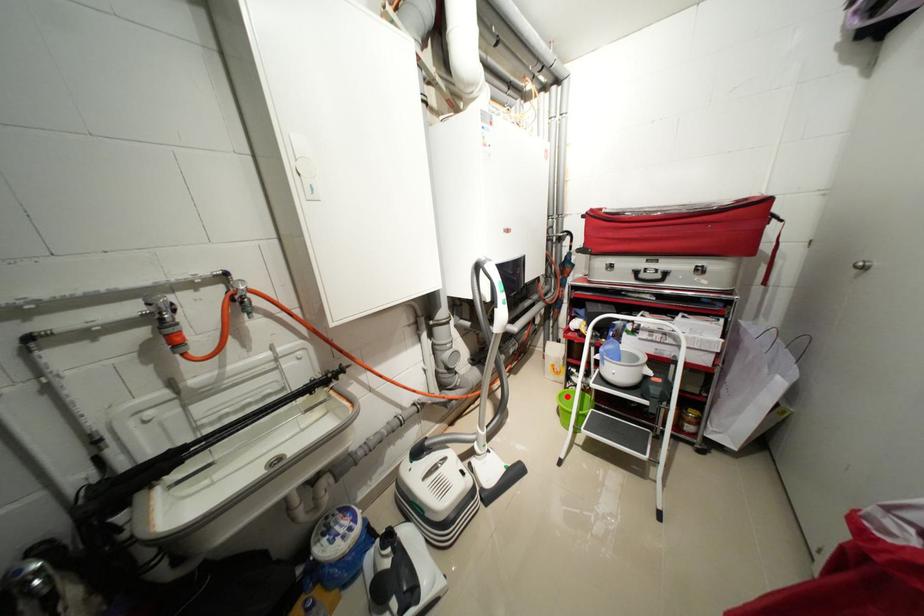
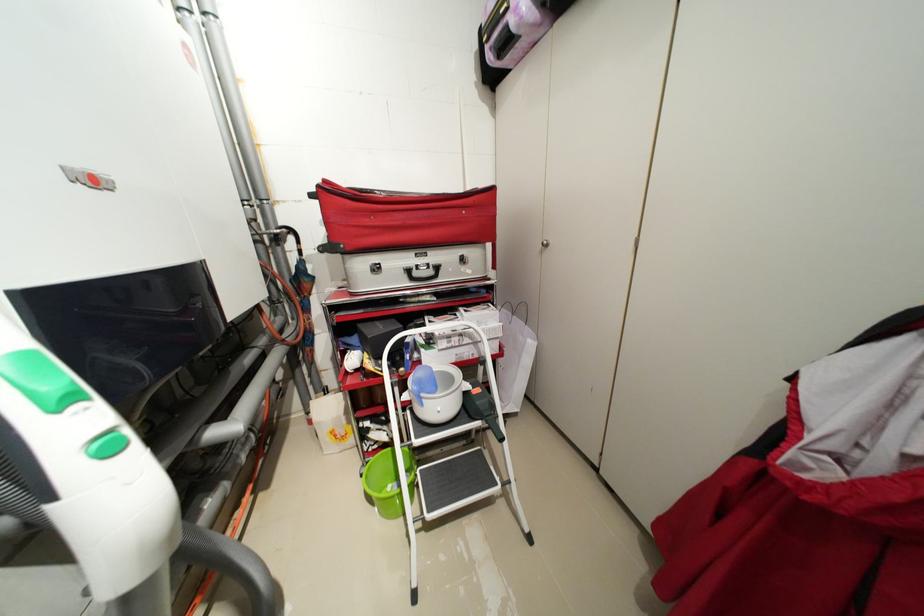
Question: A red point is marked in image1. In image2, is the corresponding 3D point closer to the camera or farther? Reply with the corresponding letter.

Choices:
 (A) The corresponding 3D point is closer.
 (B) The corresponding 3D point is farther.

Answer: (B)